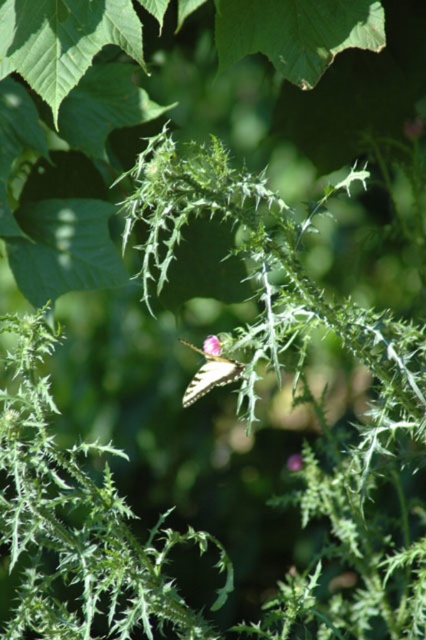
Question: Does yellow matte butterfly at center lie in front of smooth pink flower at center?

Choices:
 (A) no
 (B) yes

Answer: (B)

Question: Which object is closer to the camera taking this photo?

Choices:
 (A) smooth pink flower at center
 (B) yellow matte butterfly at center

Answer: (B)

Question: Among these points, which one is farthest from the camera?

Choices:
 (A) (204, 352)
 (B) (189, 387)

Answer: (B)

Question: Does yellow matte butterfly at center have a lesser width compared to smooth pink flower at center?

Choices:
 (A) no
 (B) yes

Answer: (A)

Question: Which of the following is the farthest from the observer?

Choices:
 (A) yellow matte butterfly at center
 (B) smooth pink flower at center

Answer: (B)

Question: Is yellow matte butterfly at center smaller than smooth pink flower at center?

Choices:
 (A) no
 (B) yes

Answer: (A)